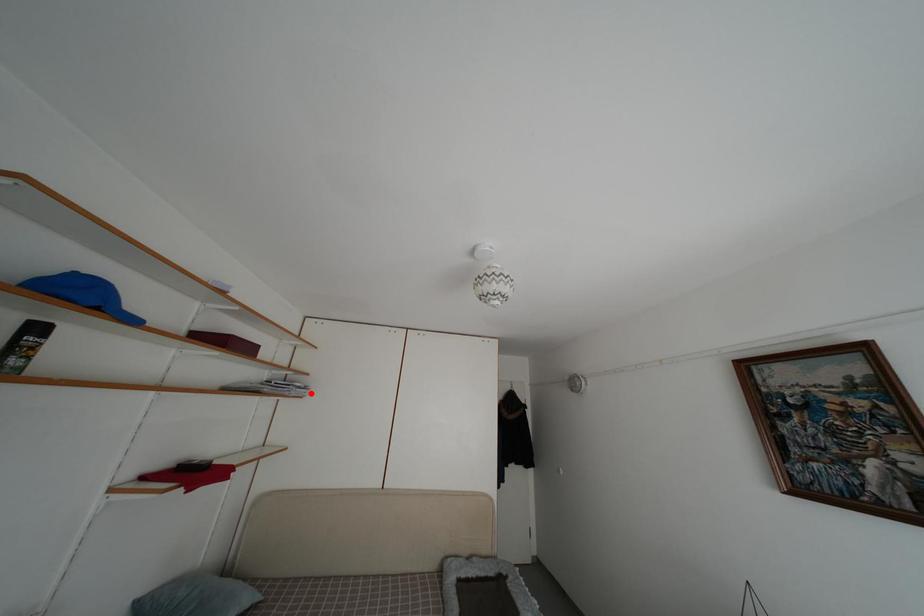
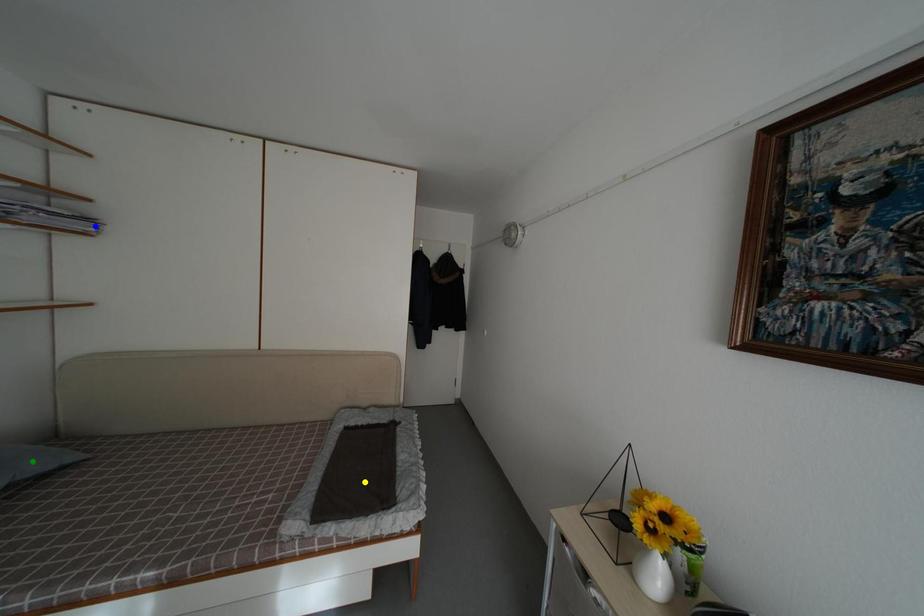
Question: I am providing you with two images of the same scene from different viewpoints. A red point is marked on the first image. You are given multiple points on the second image. In image 2, which mark is for the same physical point as the one in image 1?

Choices:
 (A) yellow point
 (B) green point
 (C) blue point

Answer: (C)